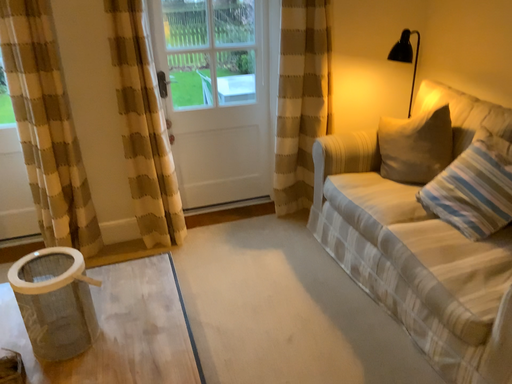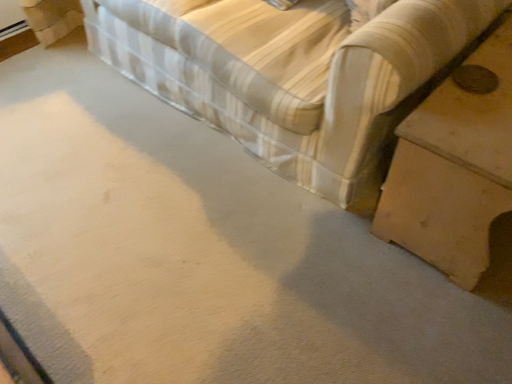
Question: How did the camera likely rotate when shooting the video?

Choices:
 (A) rotated downward
 (B) rotated upward

Answer: (A)